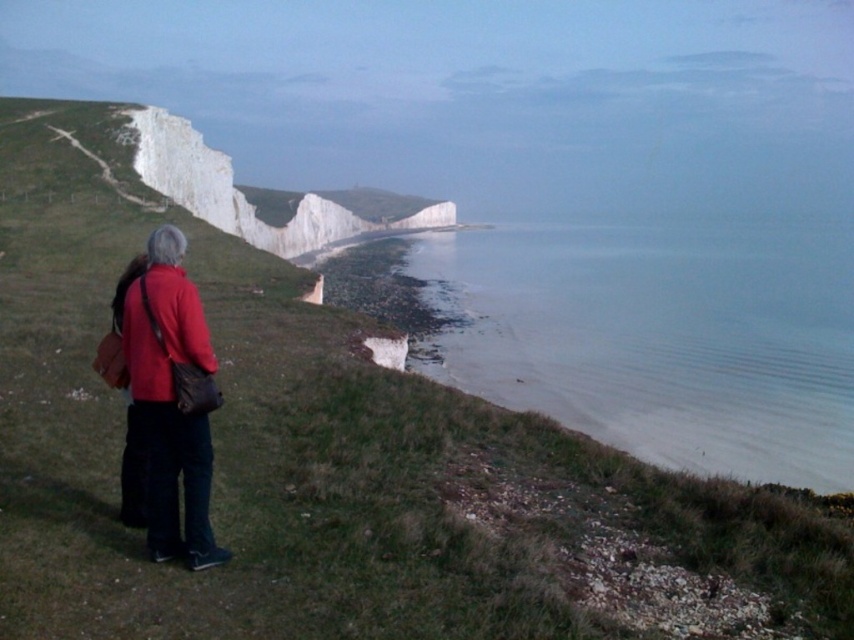
Question: Which point is farther to the camera?

Choices:
 (A) (135, 353)
 (B) (151, 330)
 (C) (550, 257)

Answer: (C)

Question: Can you confirm if matte red jacket at lower left is wider than matte red coat at lower left?

Choices:
 (A) yes
 (B) no

Answer: (B)

Question: Based on their relative distances, which object is farther from the clear water at lower right?

Choices:
 (A) matte red jacket at lower left
 (B) matte red coat at lower left

Answer: (A)

Question: Which point is closer to the camera taking this photo?

Choices:
 (A) (145, 289)
 (B) (619, 316)
 (C) (126, 353)

Answer: (A)

Question: Is matte red jacket at lower left thinner than matte red coat at lower left?

Choices:
 (A) no
 (B) yes

Answer: (B)

Question: Can you confirm if matte red jacket at lower left is positioned below matte red coat at lower left?

Choices:
 (A) no
 (B) yes

Answer: (B)